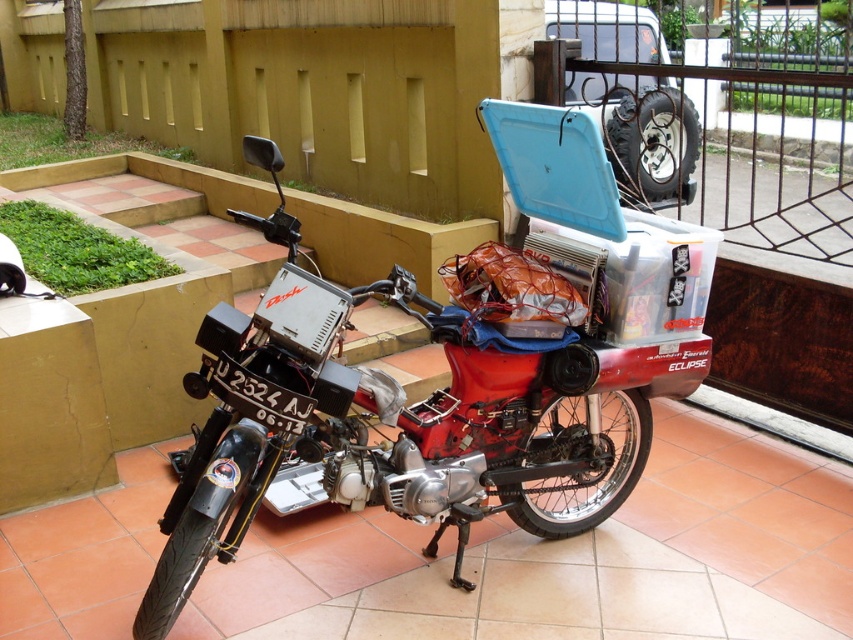
You are a delivery person trying to park your motorcycle between the red matte motorcycle at center and the black metal fence at upper right. Can you fit your motorcycle there?

The red matte motorcycle at center is to the left of the black metal fence at upper right, so there is space between them. Your motorcycle can be parked there.

Looking at this image, based on the scene description, where is the red matte motorcycle at center located in terms of coordinates?

The red matte motorcycle at center is located at coordinates point (412, 404).